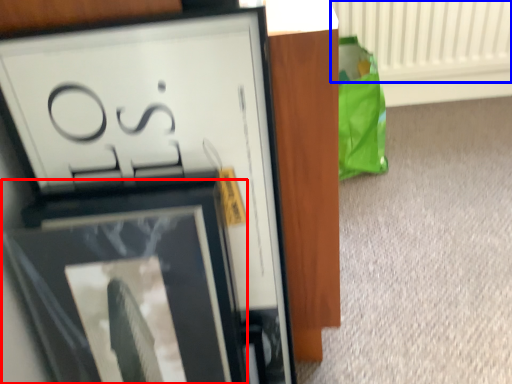
Question: Which object is further to the camera taking this photo, picture frame (highlighted by a red box) or radiator (highlighted by a blue box)?

Choices:
 (A) picture frame
 (B) radiator

Answer: (B)